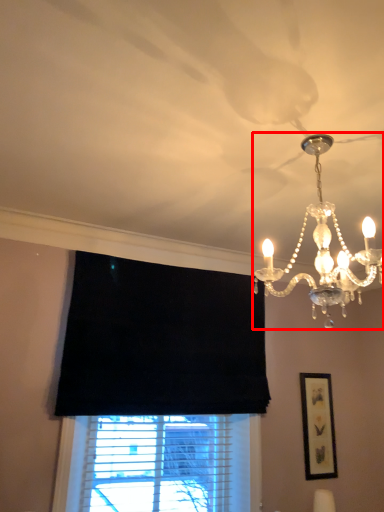
Question: Considering the relative positions of lamp (annotated by the red box) and picture frame in the image provided, where is lamp (annotated by the red box) located with respect to the staircase?

Choices:
 (A) left
 (B) right

Answer: (A)